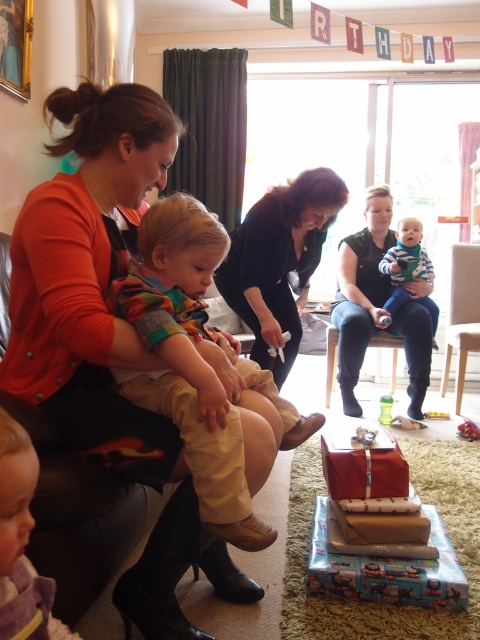
From the picture: Is striped cotton shirt at center to the right of wooden toy at center from the viewer's perspective?

In fact, striped cotton shirt at center is to the left of wooden toy at center.

Is striped cotton shirt at center to the left of wooden toy at center from the viewer's perspective?

Indeed, striped cotton shirt at center is positioned on the left side of wooden toy at center.

Between point (400, 284) and point (425, 413), which one is positioned behind?

The point (400, 284) is more distant.

At what (x,y) coordinates should I click in order to perform the action: click on striped cotton shirt at center. Please return your answer as a coordinate pair (x, y). The height and width of the screenshot is (640, 480). Looking at the image, I should click on (406, 262).

Between black leather jacket at upper right and striped cotton shirt at center, which one appears on the right side from the viewer's perspective?

From the viewer's perspective, striped cotton shirt at center appears more on the right side.

Locate an element on the screen. black leather jacket at upper right is located at coordinates (376, 307).

I want to click on black leather jacket at upper right, so click(376, 307).

Who is higher up, light brown cotton pants at center or translucent plastic cup at center?

light brown cotton pants at center is above.

Does point (232, 429) come behind point (389, 419)?

No, it is in front of (389, 419).

The image size is (480, 640). Find the location of `light brown cotton pants at center`. light brown cotton pants at center is located at coordinates (192, 356).